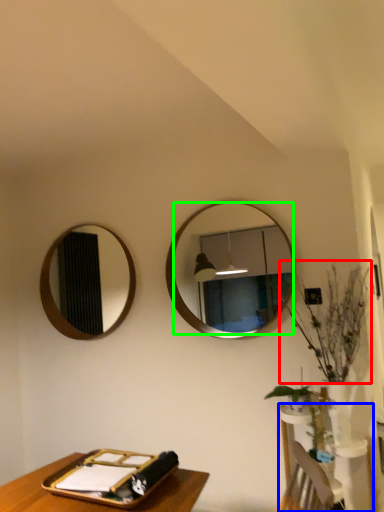
Question: Which is farther away from floral arrangement (highlighted by a red box)? vanity (highlighted by a blue box) or mirror (highlighted by a green box)?

Choices:
 (A) vanity
 (B) mirror

Answer: (A)